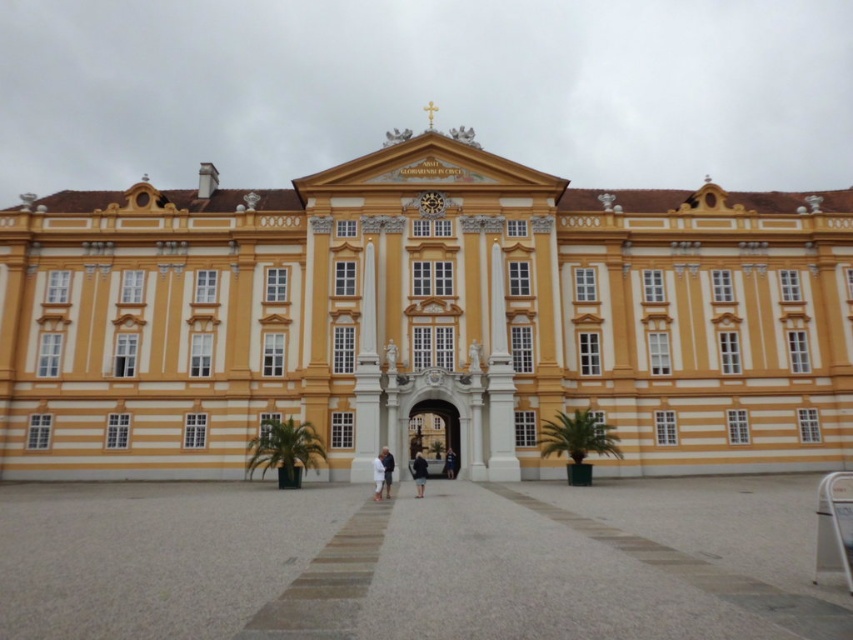
Question: Among these points, which one is farthest from the camera?

Choices:
 (A) (454, 465)
 (B) (379, 458)

Answer: (A)

Question: Is white fabric at center below light blue fabric coat at center?

Choices:
 (A) no
 (B) yes

Answer: (B)

Question: Is white fabric at center smaller than light blue fabric coat at center?

Choices:
 (A) yes
 (B) no

Answer: (B)

Question: Which point is farther to the camera?

Choices:
 (A) (206, 310)
 (B) (376, 461)

Answer: (A)

Question: Which point is closer to the camera?

Choices:
 (A) 384,484
 (B) 378,496
 (C) 283,570
 (D) 51,195

Answer: (C)

Question: Does yellow matte building at center have a lesser width compared to light blue fabric coat at center?

Choices:
 (A) yes
 (B) no

Answer: (B)